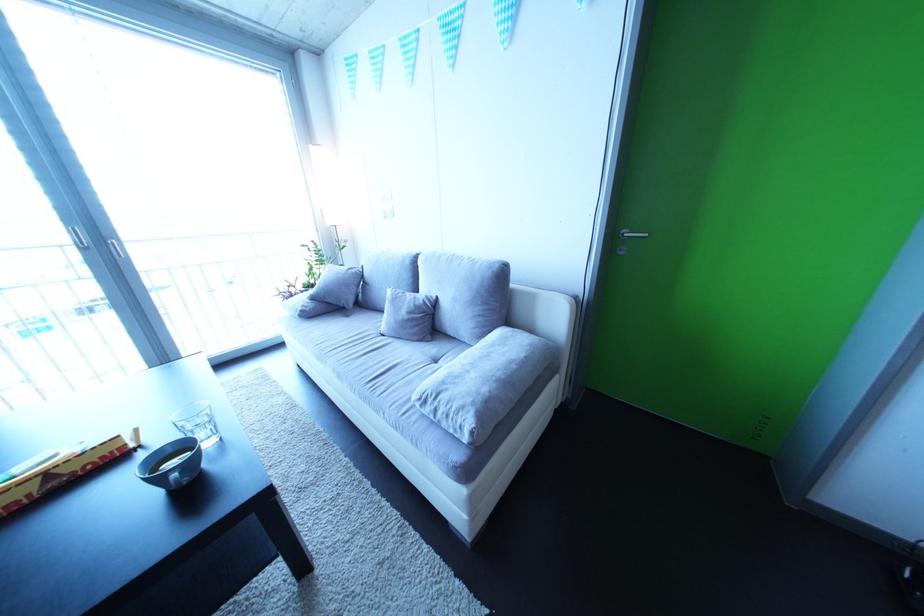
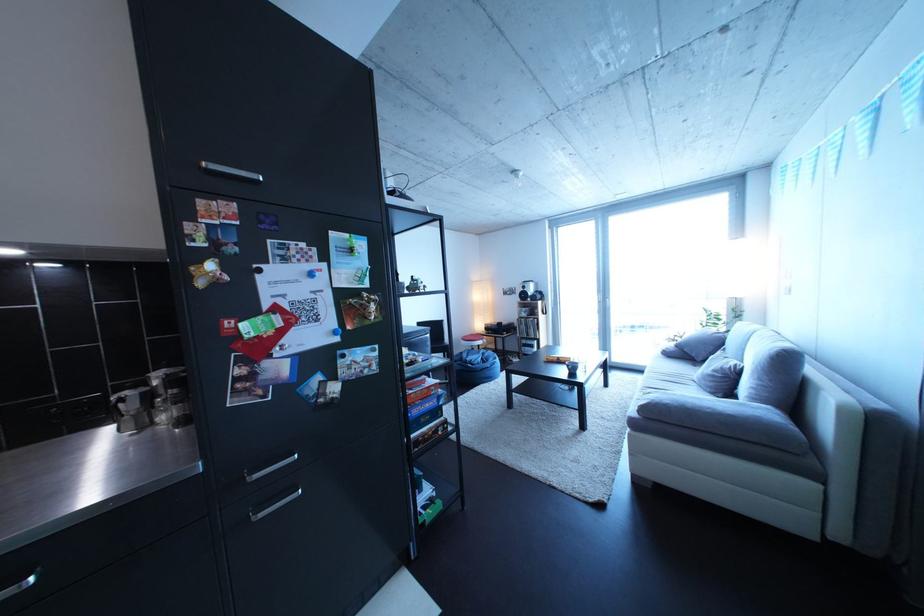
Locate, in the second image, the point that corresponds to the point at 322,322 in the first image.

(682, 361)